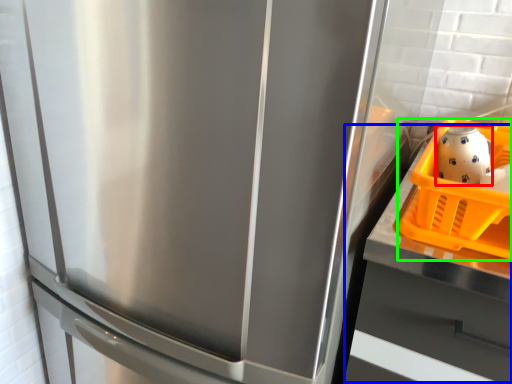
Question: Considering the real-world distances, which object is closest to tea pot (highlighted by a red box)? counter top (highlighted by a blue box) or basket (highlighted by a green box).

Choices:
 (A) counter top
 (B) basket

Answer: (B)